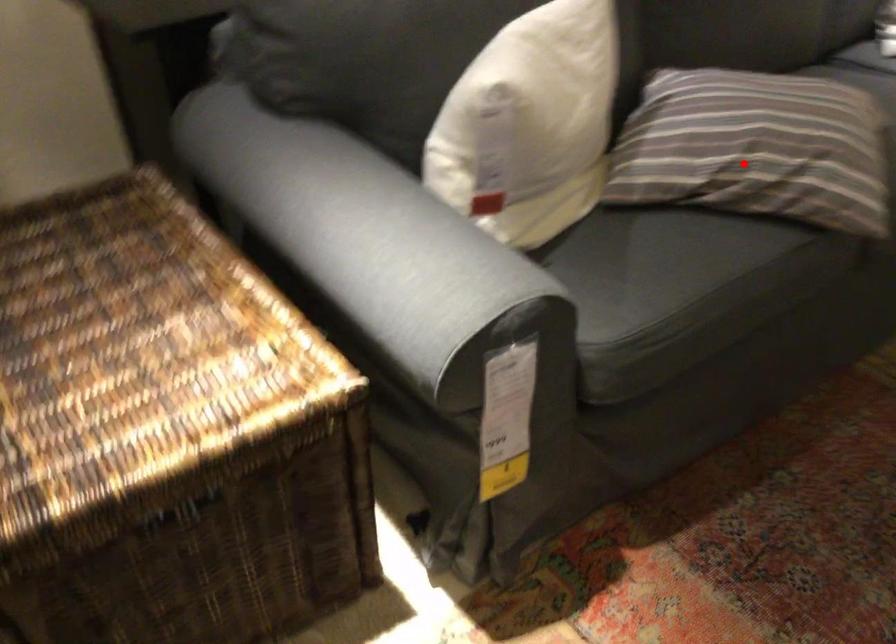
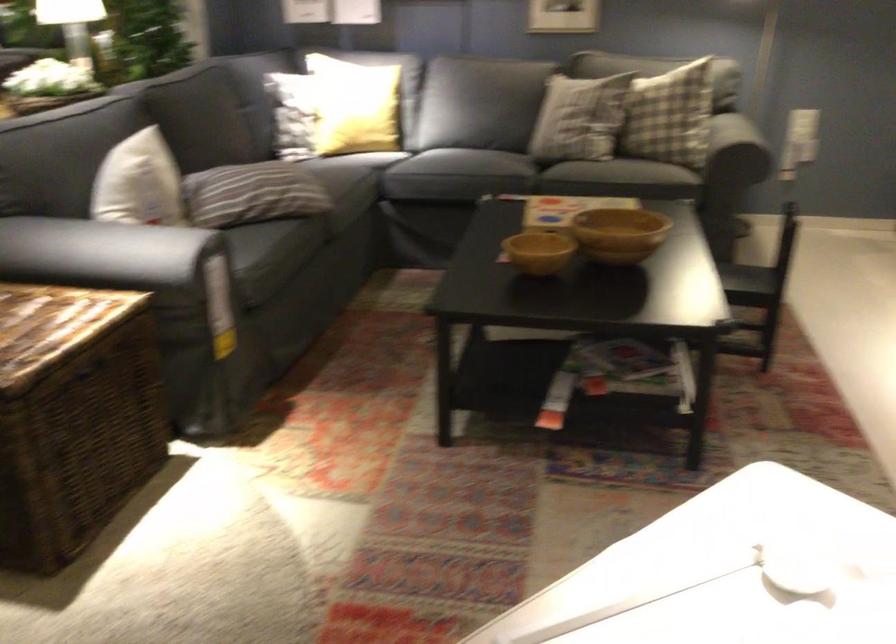
The point at the highlighted location is marked in the first image. Where is the corresponding point in the second image?

(261, 194)